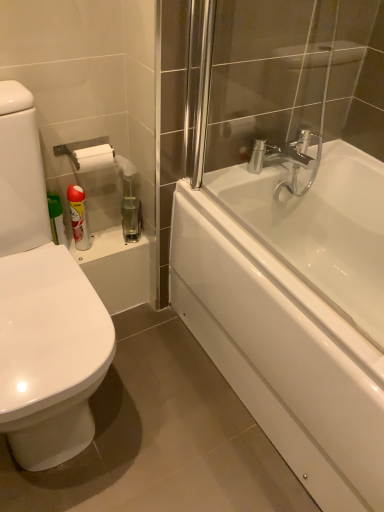
Image resolution: width=384 pixels, height=512 pixels. What do you see at coordinates (129, 202) in the screenshot?
I see `translucent plastic spray bottle at upper left` at bounding box center [129, 202].

Image resolution: width=384 pixels, height=512 pixels. What are the coordinates of `white glossy bathtub at right` in the screenshot? It's located at (294, 312).

From a real-world perspective, between white glossy bathtub at right and white glossy bathtub at right, who is vertically lower?

In real-world perspective, white glossy bathtub at right is lower.

Is white glossy bathtub at right positioned behind white glossy bathtub at right?

Yes, white glossy bathtub at right is further from the camera.

Does white glossy bathtub at right appear on the right side of white glossy bathtub at right?

Yes.

The width and height of the screenshot is (384, 512). I want to click on bath on the left of white glossy bathtub at right, so click(320, 228).

Looking at this image, which object is positioned more to the right, white glossy bathtub at right or clear glass shower door at upper right?

Positioned to the right is clear glass shower door at upper right.

Is white glossy bathtub at right facing towards clear glass shower door at upper right?

No, white glossy bathtub at right is not facing towards clear glass shower door at upper right.

Which of these two, white glossy bathtub at right or clear glass shower door at upper right, is bigger?

With larger size is clear glass shower door at upper right.

From the image's perspective, is white glossy bathtub at right on top of white glossy can at upper left?

Yes, from the image's perspective, white glossy bathtub at right is over white glossy can at upper left.

Are white glossy bathtub at right and white glossy can at upper left located far from each other?

No, there isn't a large distance between white glossy bathtub at right and white glossy can at upper left.

Identify the location of bath located above the white glossy can at upper left (from a real-world perspective). This screenshot has height=512, width=384. (320, 228).

How many degrees apart are the facing directions of white glossy bathtub at right and white glossy can at upper left?

90.3 degrees separate the facing orientations of white glossy bathtub at right and white glossy can at upper left.

From the image's perspective, between white glossy bathtub at right and white glossy bathtub at right, who is located below?

white glossy bathtub at right, from the image's perspective.

Is white glossy bathtub at right surrounding white glossy bathtub at right?

No, white glossy bathtub at right is not a part of white glossy bathtub at right.

Considering the relative positions of white glossy bathtub at right and white glossy bathtub at right in the image provided, is white glossy bathtub at right to the left of white glossy bathtub at right from the viewer's perspective?

Correct, you'll find white glossy bathtub at right to the left of white glossy bathtub at right.

Is white glossy can at upper left positioned behind clear glass shower door at upper right?

Yes, the depth of white glossy can at upper left is greater than that of clear glass shower door at upper right.

Is clear glass shower door at upper right at the back of white glossy can at upper left?

white glossy can at upper left does not have its back to clear glass shower door at upper right.

Does white glossy can at upper left have a smaller size compared to clear glass shower door at upper right?

Yes, white glossy can at upper left is smaller than clear glass shower door at upper right.

How many degrees apart are the facing directions of white glossy can at upper left and clear glass shower door at upper right?

0.343 degrees.

Does point (76, 213) come behind point (139, 236)?

No, (76, 213) is closer to viewer.

Is white glossy can at upper left completely or partially outside of translucent plastic spray bottle at upper left?

Yes.

From a real-world perspective, which object stands above the other?

translucent plastic spray bottle at upper left, from a real-world perspective.

Is translucent plastic spray bottle at upper left at the back of white glossy can at upper left?

No, white glossy can at upper left's orientation is not away from translucent plastic spray bottle at upper left.

Between point (383, 119) and point (327, 289), which one is positioned in front?

The point (383, 119) is more forward.

From the image's perspective, between clear glass shower door at upper right and white glossy bathtub at right, who is located below?

white glossy bathtub at right.

Is clear glass shower door at upper right positioned beyond the bounds of white glossy bathtub at right?

Yes, clear glass shower door at upper right is not within white glossy bathtub at right.

I want to click on bathtub lying below the white glossy bathtub at right (from the image's perspective), so click(294, 312).

Locate an element on the screen. The height and width of the screenshot is (512, 384). bath in front of the clear glass shower door at upper right is located at coordinates (320, 228).

Considering their positions, is white glossy bathtub at right positioned further to translucent plastic spray bottle at upper left than clear glass shower door at upper right?

clear glass shower door at upper right is further to translucent plastic spray bottle at upper left.

From the picture: From the image, which object appears to be nearer to translucent plastic spray bottle at upper left, white glossy can at upper left or clear glass shower door at upper right?

white glossy can at upper left is positioned closer to the anchor translucent plastic spray bottle at upper left.

Estimate the real-world distances between objects in this image. Which object is further from white glossy bathtub at right, white glossy bathtub at right or clear glass shower door at upper right?

The object further to white glossy bathtub at right is clear glass shower door at upper right.

When comparing their distances from white glossy can at upper left, does translucent plastic spray bottle at upper left or clear glass shower door at upper right seem further?

Among the two, clear glass shower door at upper right is located further to white glossy can at upper left.

Estimate the real-world distances between objects in this image. Which object is closer to white glossy bathtub at right, white glossy can at upper left or translucent plastic spray bottle at upper left?

The object closer to white glossy bathtub at right is translucent plastic spray bottle at upper left.

Consider the image. Based on their spatial positions, is white glossy can at upper left or clear glass shower door at upper right further from white glossy bathtub at right?

white glossy can at upper left lies further to white glossy bathtub at right than the other object.

Based on their spatial positions, is translucent plastic spray bottle at upper left or white glossy bathtub at right further from clear glass shower door at upper right?

translucent plastic spray bottle at upper left is further to clear glass shower door at upper right.

Estimate the real-world distances between objects in this image. Which object is closer to white glossy can at upper left, white glossy bathtub at right or clear glass shower door at upper right?

The object closer to white glossy can at upper left is white glossy bathtub at right.

This screenshot has height=512, width=384. I want to click on bath that lies between clear glass shower door at upper right and white glossy bathtub at right from top to bottom, so click(x=320, y=228).

At what (x,y) coordinates should I click in order to perform the action: click on shower door between white glossy bathtub at right and white glossy can at upper left in the front-back direction. Please return your answer as a coordinate pair (x, y). The height and width of the screenshot is (512, 384). Looking at the image, I should click on click(x=295, y=75).

Locate an element on the screen. cleaning product between white glossy can at upper left and white glossy bathtub at right in the horizontal direction is located at coordinates (129, 202).

You are a GUI agent. You are given a task and a screenshot of the screen. Output one action in this format:
    pyautogui.click(x=<x>, y=<y>)
    Task: Click on the toiletry positioned between white glossy bathtub at right and translucent plastic spray bottle at upper left from near to far
    The image size is (384, 512).
    Given the screenshot: What is the action you would take?
    pyautogui.click(x=78, y=217)